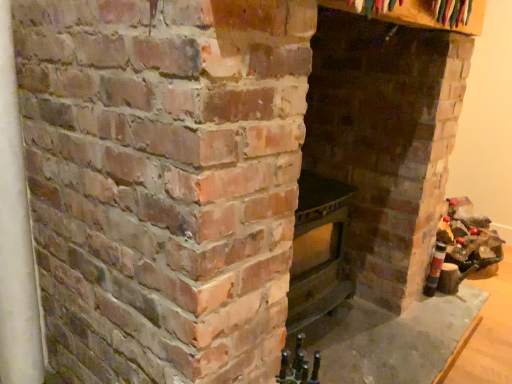
Locate an element on the screen. The width and height of the screenshot is (512, 384). rustic brick pillar at left is located at coordinates (15, 235).

What do you see at coordinates (15, 235) in the screenshot?
I see `rustic brick pillar at left` at bounding box center [15, 235].

You are a GUI agent. You are given a task and a screenshot of the screen. Output one action in this format:
    pyautogui.click(x=<x>, y=<y>)
    Task: Click on the rustic brick pillar at left
    
    Given the screenshot: What is the action you would take?
    pyautogui.click(x=15, y=235)